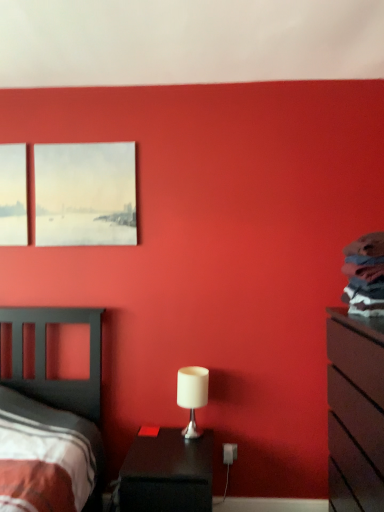
Question: From the image's perspective, is matte canvas painting at upper left located above matte black dresser at right?

Choices:
 (A) no
 (B) yes

Answer: (B)

Question: Is matte canvas painting at upper left behind matte black dresser at right?

Choices:
 (A) no
 (B) yes

Answer: (B)

Question: Does matte canvas painting at upper left turn towards matte black dresser at right?

Choices:
 (A) no
 (B) yes

Answer: (A)

Question: From the image's perspective, is matte canvas painting at upper left below matte black dresser at right?

Choices:
 (A) yes
 (B) no

Answer: (B)

Question: Does matte canvas painting at upper left appear on the left side of matte black dresser at right?

Choices:
 (A) no
 (B) yes

Answer: (B)

Question: Looking at the image, does matte canvas painting at upper left seem bigger or smaller compared to white matte table lamp at center?

Choices:
 (A) big
 (B) small

Answer: (A)

Question: Based on their positions, is matte canvas painting at upper left located to the left or right of white matte table lamp at center?

Choices:
 (A) right
 (B) left

Answer: (B)

Question: From the image's perspective, is matte canvas painting at upper left above or below white matte table lamp at center?

Choices:
 (A) below
 (B) above

Answer: (B)

Question: Is matte canvas painting at upper left wider or thinner than white matte table lamp at center?

Choices:
 (A) thin
 (B) wide

Answer: (A)

Question: From a real-world perspective, is white matte table lamp at center above or below matte black dresser at right?

Choices:
 (A) above
 (B) below

Answer: (A)

Question: Considering the positions of point (192, 409) and point (345, 311), is point (192, 409) closer or farther from the camera than point (345, 311)?

Choices:
 (A) farther
 (B) closer

Answer: (A)

Question: Looking at the image, does white matte table lamp at center seem bigger or smaller compared to matte black dresser at right?

Choices:
 (A) small
 (B) big

Answer: (A)

Question: From their relative heights in the image, would you say white matte table lamp at center is taller or shorter than matte black dresser at right?

Choices:
 (A) tall
 (B) short

Answer: (B)

Question: From the image's perspective, is white matte table lamp at center located above or below black glossy nightstand at lower center?

Choices:
 (A) below
 (B) above

Answer: (B)

Question: Would you say white matte table lamp at center is to the left or to the right of black glossy nightstand at lower center in the picture?

Choices:
 (A) left
 (B) right

Answer: (B)